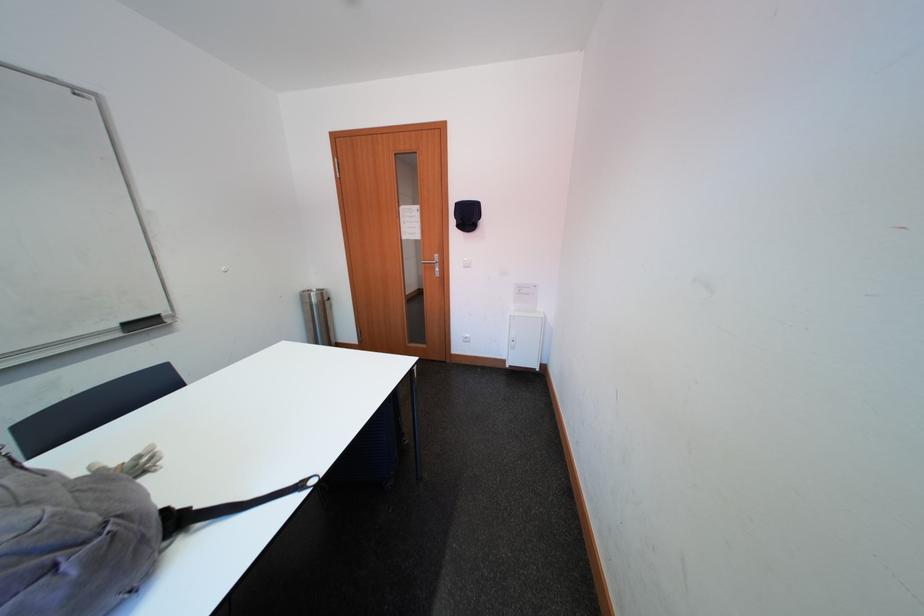
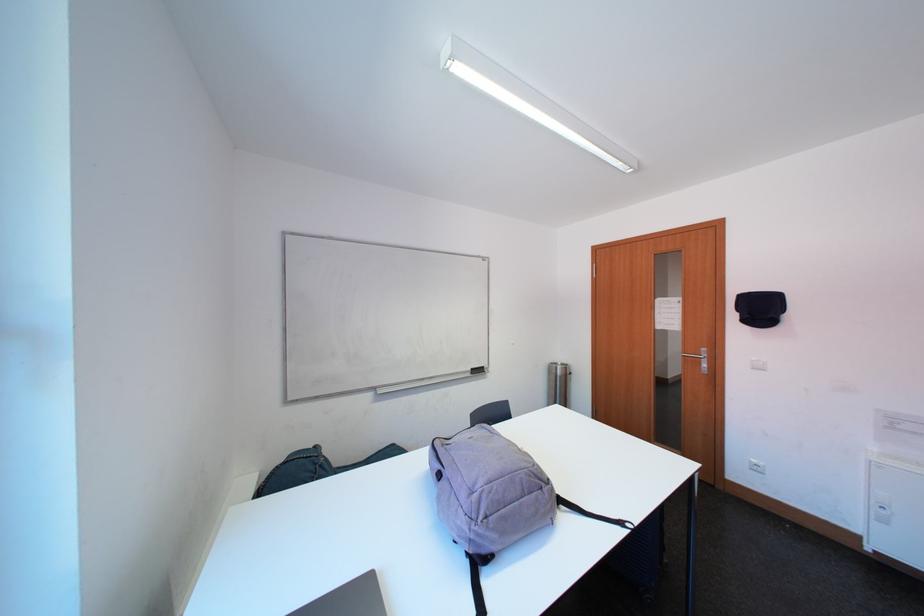
Locate, in the second image, the point that corresponds to point (478, 220) in the first image.

(771, 313)